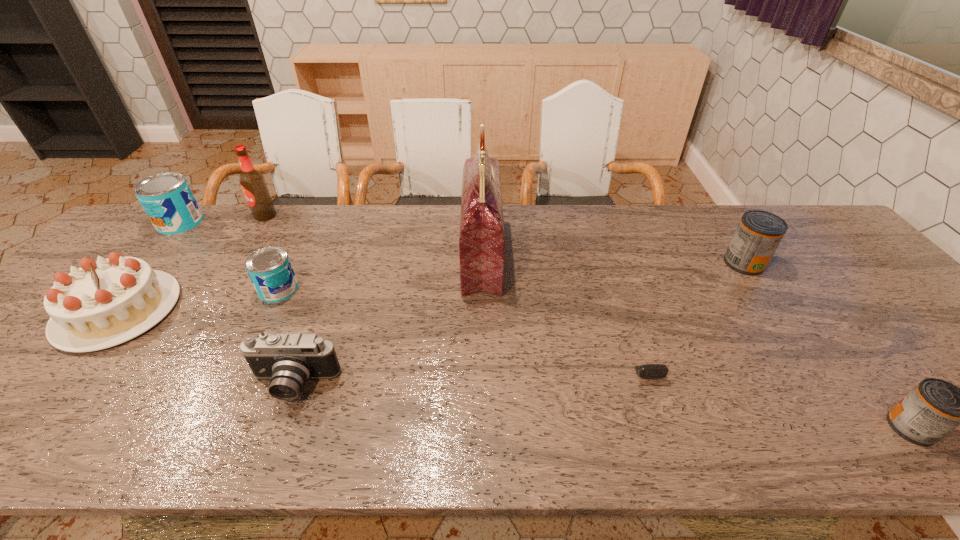
Locate an element on the screen. can that is at the left edge is located at coordinates (167, 199).

The image size is (960, 540). I want to click on birthday cake that is at the left edge, so pyautogui.click(x=101, y=304).

Locate an element on the screen. The image size is (960, 540). object that is at the far left corner is located at coordinates (167, 199).

Identify the location of vacant area at the far edge. The width and height of the screenshot is (960, 540). (228, 215).

In the image, there is a desktop. Where is `free space at the near edge`? This screenshot has width=960, height=540. free space at the near edge is located at coordinates (819, 421).

In the image, there is a desktop. At what (x,y) coordinates should I click in order to perform the action: click on free space at the right edge. Please return your answer as a coordinate pair (x, y). Looking at the image, I should click on (870, 301).

The width and height of the screenshot is (960, 540). I want to click on free space between the tallest object and the black camera, so click(388, 320).

The width and height of the screenshot is (960, 540). I want to click on free space between the tallest object and the birthday cake, so click(x=300, y=283).

Where is `free space between the nearer blue can and the fourth object from right to left`? free space between the nearer blue can and the fourth object from right to left is located at coordinates (380, 273).

Identify the location of free area in between the black camera and the tallest object. (388, 320).